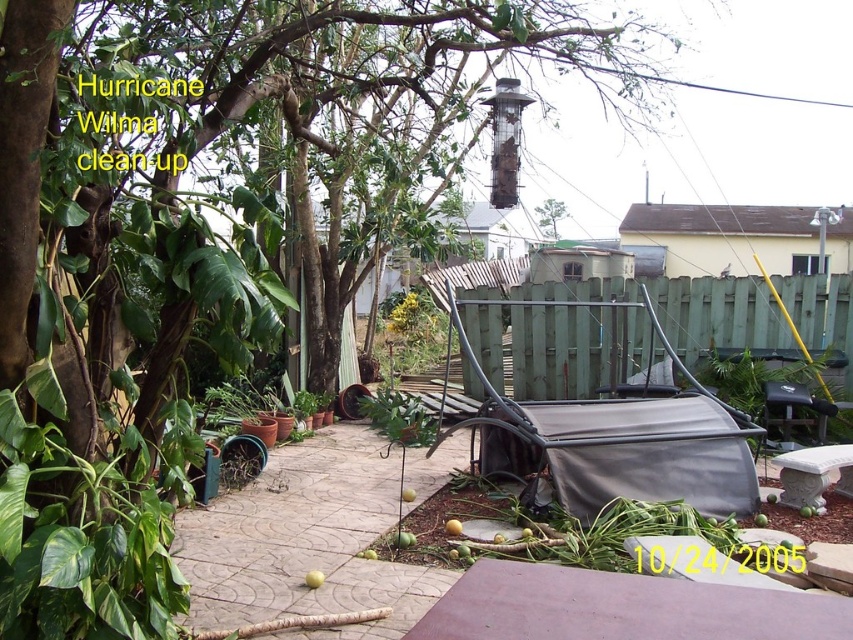
Question: Is the position of green wood fence at center less distant than that of green leafy tree at upper center?

Choices:
 (A) yes
 (B) no

Answer: (A)

Question: Which object is farther from the camera taking this photo?

Choices:
 (A) green wood fence at center
 (B) green leafy tree at upper center

Answer: (B)

Question: Can you confirm if green wood fence at center is positioned below green leafy tree at upper center?

Choices:
 (A) yes
 (B) no

Answer: (A)

Question: Is green wood fence at center further to the viewer compared to green leafy tree at upper center?

Choices:
 (A) yes
 (B) no

Answer: (B)

Question: Which object is closer to the camera taking this photo?

Choices:
 (A) green leafy tree at upper center
 (B) green wood fence at center

Answer: (B)